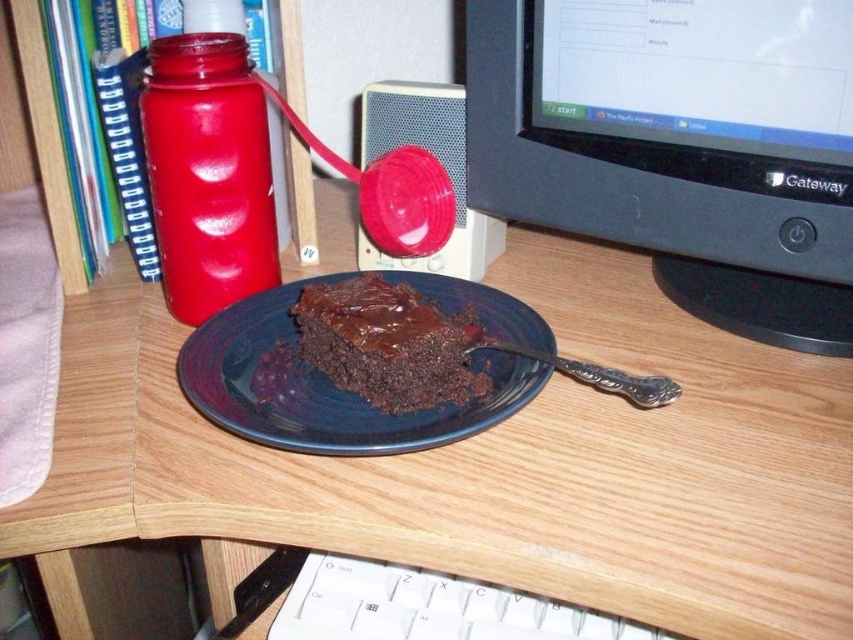
Is black plastic computer monitor at center closer to the viewer compared to matte plastic bottle at left?

Yes, it is.

Can you confirm if black plastic computer monitor at center is positioned to the right of matte plastic bottle at left?

Correct, you'll find black plastic computer monitor at center to the right of matte plastic bottle at left.

Is point (683, 208) in front of point (142, 118)?

No, (683, 208) is behind (142, 118).

Identify the location of black plastic computer monitor at center. This screenshot has width=853, height=640. (679, 145).

Does matte black plate at center appear on the left side of white plastic keyboard at lower center?

Yes, matte black plate at center is to the left of white plastic keyboard at lower center.

Can you confirm if matte black plate at center is shorter than white plastic keyboard at lower center?

No, matte black plate at center is not shorter than white plastic keyboard at lower center.

Is point (201, 486) closer to camera compared to point (381, 573)?

Yes, point (201, 486) is closer to viewer.

Locate an element on the screen. This screenshot has height=640, width=853. matte black plate at center is located at coordinates (486, 465).

Which is below, white plastic keyboard at lower center or chocolate glossy cake at center?

Positioned lower is white plastic keyboard at lower center.

What do you see at coordinates (428, 608) in the screenshot?
I see `white plastic keyboard at lower center` at bounding box center [428, 608].

Between point (321, 579) and point (369, 346), which one is positioned in front?

Point (369, 346) is in front.

You are a GUI agent. You are given a task and a screenshot of the screen. Output one action in this format:
    pyautogui.click(x=<x>, y=<y>)
    Task: Click on the white plastic keyboard at lower center
    
    Given the screenshot: What is the action you would take?
    pyautogui.click(x=428, y=608)